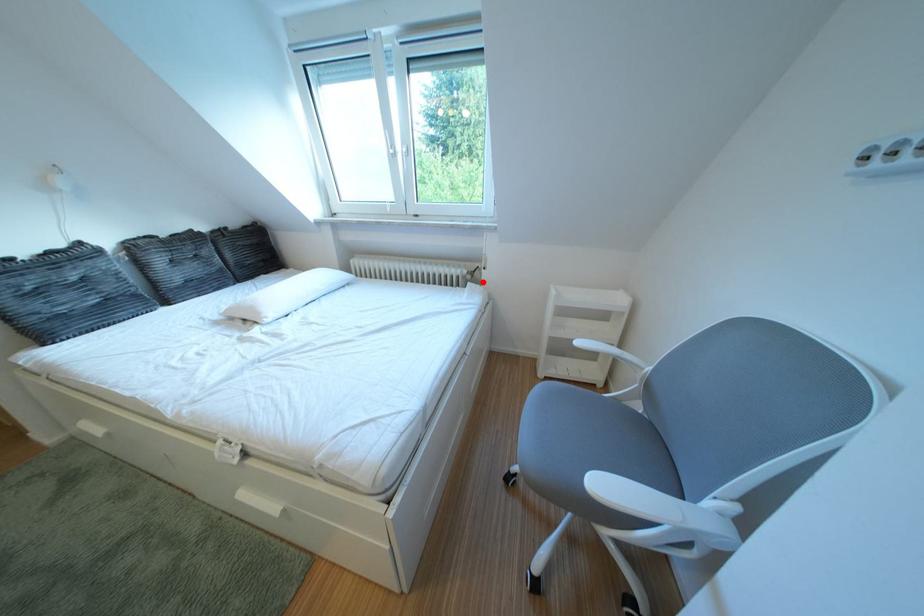
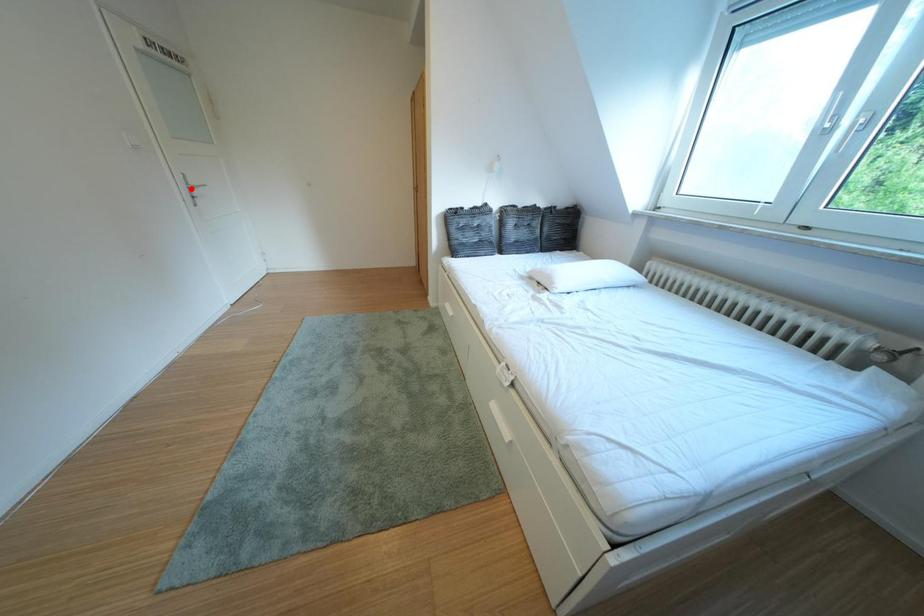
I am providing you with two images of the same scene from different viewpoints. A red point is marked on the first image and another point is marked on the second image. Is the red point in image1 aligned with the point shown in image2?

No